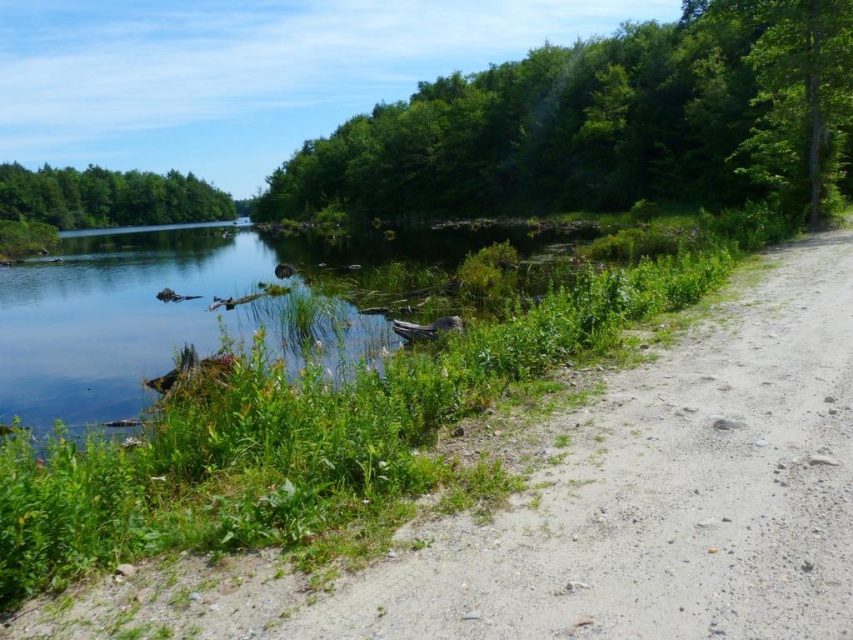
Question: Which point is farther to the camera?

Choices:
 (A) green matte tree at upper left
 (B) green leafy tree at upper right

Answer: (A)

Question: Which point is closer to the camera?

Choices:
 (A) (698, 161)
 (B) (54, 221)

Answer: (A)

Question: Which of the following is the farthest from the observer?

Choices:
 (A) (3, 188)
 (B) (515, 192)

Answer: (A)

Question: Can you confirm if green leafy tree at upper right is positioned to the left of green matte tree at upper left?

Choices:
 (A) no
 (B) yes

Answer: (A)

Question: Does green leafy tree at upper right have a larger size compared to green matte tree at upper left?

Choices:
 (A) no
 (B) yes

Answer: (A)

Question: Does green leafy tree at upper right have a larger size compared to green matte tree at upper left?

Choices:
 (A) yes
 (B) no

Answer: (B)